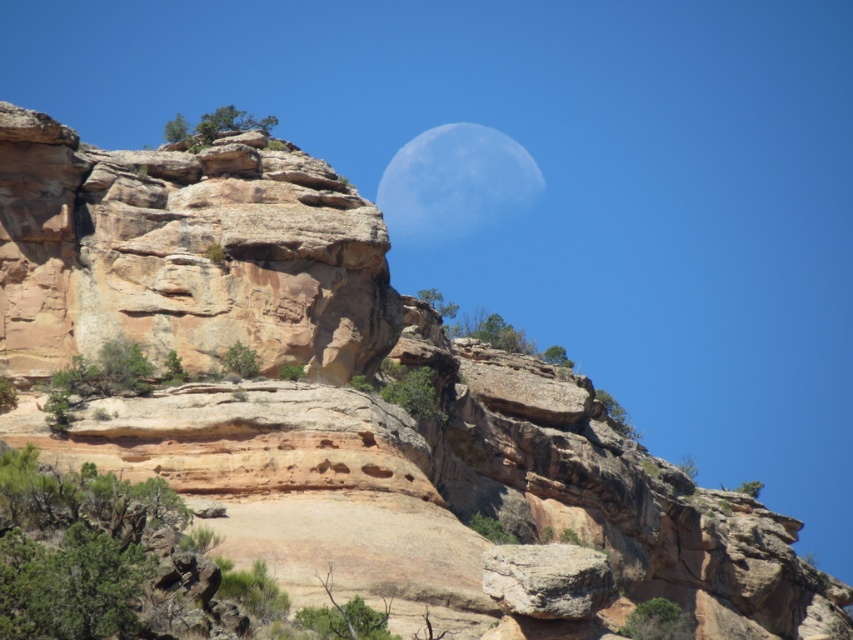
Question: Is rustic sandstone cliff at upper left positioned in front of slightly grayish-white textured moon at upper center?

Choices:
 (A) no
 (B) yes

Answer: (B)

Question: Among these objects, which one is nearest to the camera?

Choices:
 (A) rustic sandstone cliff at upper left
 (B) rustic brown rock at center

Answer: (B)

Question: Considering the relative positions of slightly grayish-white textured moon at upper center and rustic brown rock at center in the image provided, where is slightly grayish-white textured moon at upper center located with respect to rustic brown rock at center?

Choices:
 (A) right
 (B) left

Answer: (B)

Question: Which point is closer to the camera taking this photo?

Choices:
 (A) (480, 195)
 (B) (502, 572)
 (C) (141, 252)

Answer: (B)

Question: Is rustic sandstone cliff at upper left further to the viewer compared to slightly grayish-white textured moon at upper center?

Choices:
 (A) yes
 (B) no

Answer: (B)

Question: Among these objects, which one is farthest from the camera?

Choices:
 (A) rustic brown rock at center
 (B) slightly grayish-white textured moon at upper center

Answer: (B)